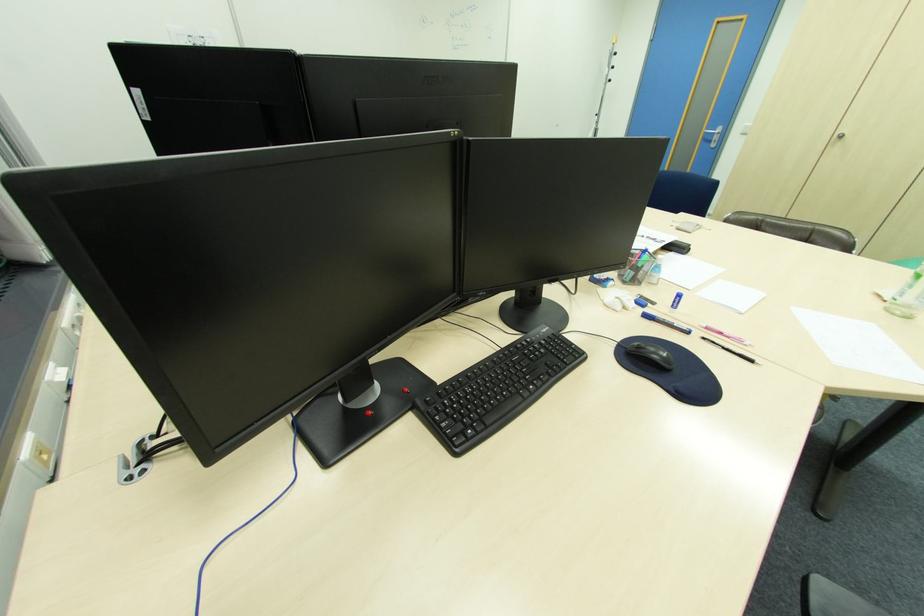
Where is `black pencil`? This screenshot has height=616, width=924. black pencil is located at coordinates (730, 350).